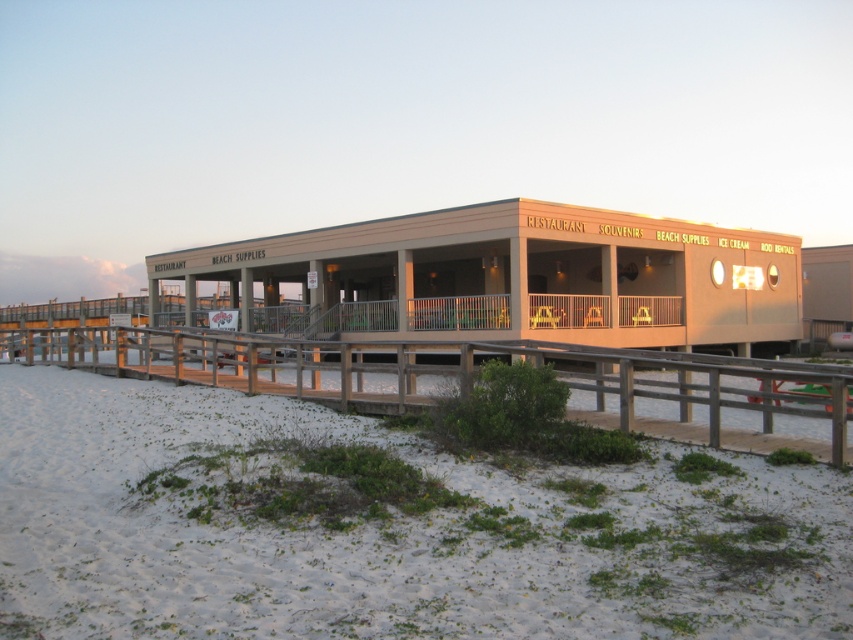
Question: Which point is farther to the camera?

Choices:
 (A) (55, 342)
 (B) (479, 488)
 (C) (753, 292)

Answer: (C)

Question: From the image, what is the correct spatial relationship of beige wooden dock at center in relation to wooden at lower left?

Choices:
 (A) right
 (B) left

Answer: (B)

Question: Can you confirm if white sandy beach at lower left is wider than wooden at lower left?

Choices:
 (A) yes
 (B) no

Answer: (B)

Question: Observing the image, what is the correct spatial positioning of white sandy beach at lower left in reference to wooden at lower left?

Choices:
 (A) right
 (B) left

Answer: (B)

Question: Which object is the closest to the beige wooden dock at center?

Choices:
 (A) white sandy beach at lower left
 (B) wooden at lower left

Answer: (B)

Question: Estimate the real-world distances between objects in this image. Which object is closer to the wooden at lower left?

Choices:
 (A) white sandy beach at lower left
 (B) beige wooden dock at center

Answer: (A)